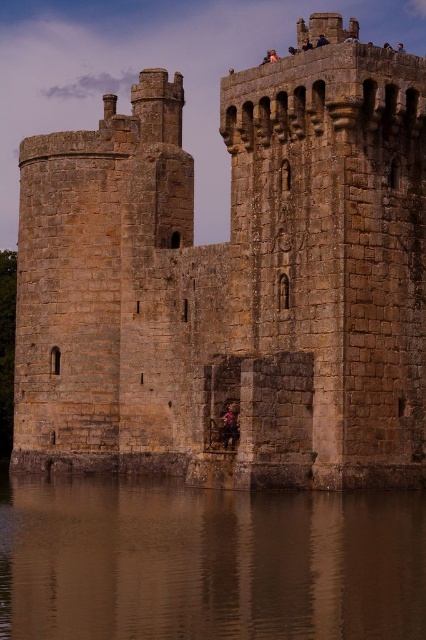
You are standing at the point marked as point (233,278) in the image of the historic stone castle. What structure are you currently on?

The point (233,278) is on the brown stone castle at center, so you are currently on the brown stone castle at center.

You are standing on the castle grounds and notice the brown matte water at lower center and the dark brown leather jacket at center. Which object appears taller in the image?

The brown matte water at lower center appears taller than the dark brown leather jacket at center according to the description.

You are a drone operator tasked with capturing aerial footage of the brown stone castle at center. The castle is located at coordinates point 0.436, 0.549. Your drone has a camera with a 120 degree field of view. If you position your drone directly above the castle, will the entire castle fit within the camera frame?

The brown stone castle at center is located at point (233, 278). Since the drone is positioned directly above the castle and the camera has a 120 degree field of view, the entire castle will fit within the camera frame as the field of view is wide enough to encompass the castle from that angle.